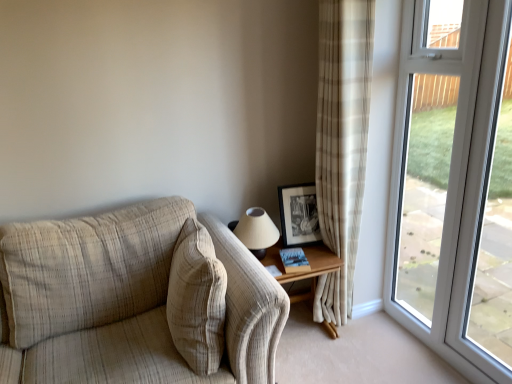
This screenshot has width=512, height=384. What are the coordinates of `free space in front of beige plaid curtain at right` in the screenshot? It's located at (351, 345).